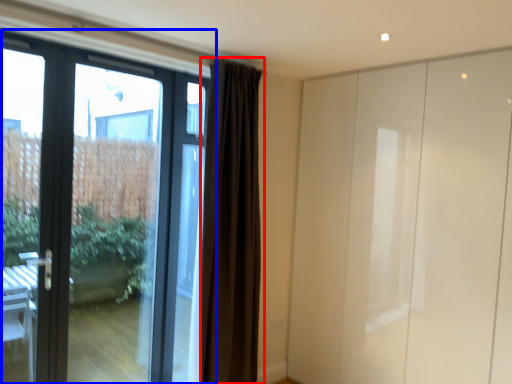
Question: Which object appears closest to the camera in this image, curtain (highlighted by a red box) or door (highlighted by a blue box)?

Choices:
 (A) curtain
 (B) door

Answer: (B)